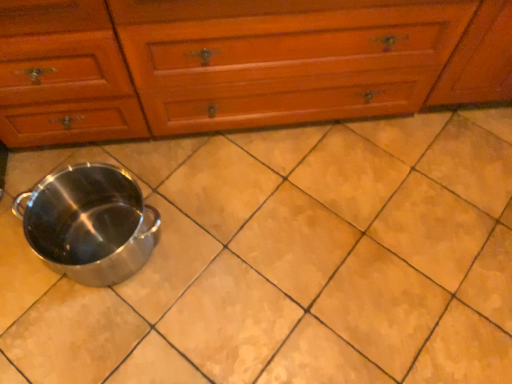
I want to click on unoccupied area in front of satin silver crock pot at lower left, so click(x=94, y=340).